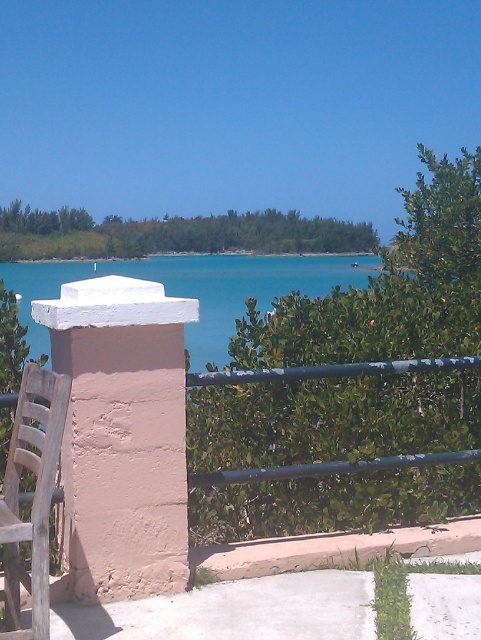
You are standing at the center of the image and want to walk towards the teal water at center. Which direction should you move?

Since the teal water at center is located at point coordinates of 0.452 on the x axis and 0.407 on the y axis, you should move towards the lower center direction to reach it.

You are standing at the vantage point looking at the scene. You notice the teal water at center and the wooden slats chair at lower left. Which object appears taller in the image?

The teal water at center appears taller than the wooden slats chair at lower left as stated in the objects description.